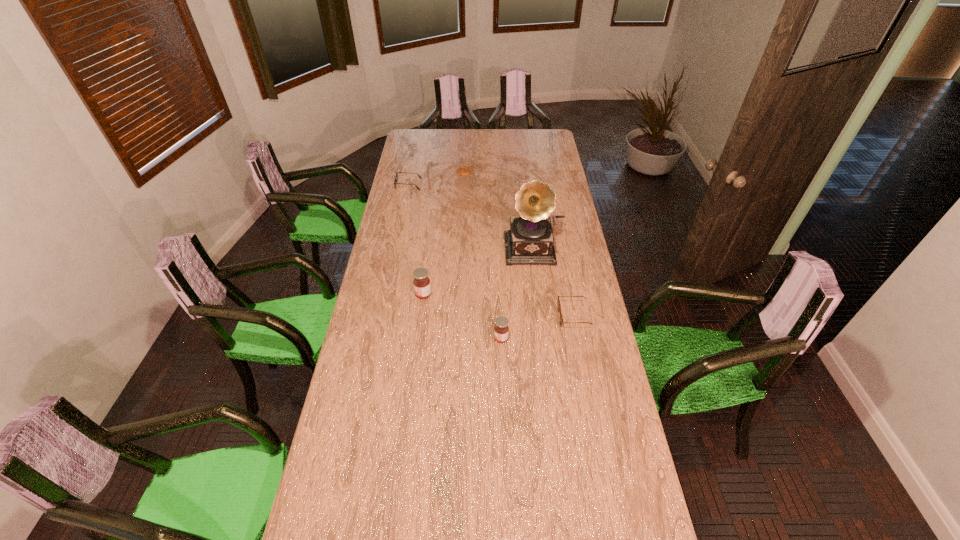
Please point a free position for a jam on the right. Please provide its 2D coordinates. Your answer should be formatted as a tuple, i.e. [(x, y)], where the tuple contains the x and y coordinates of a point satisfying the conditions above.

[(595, 392)]